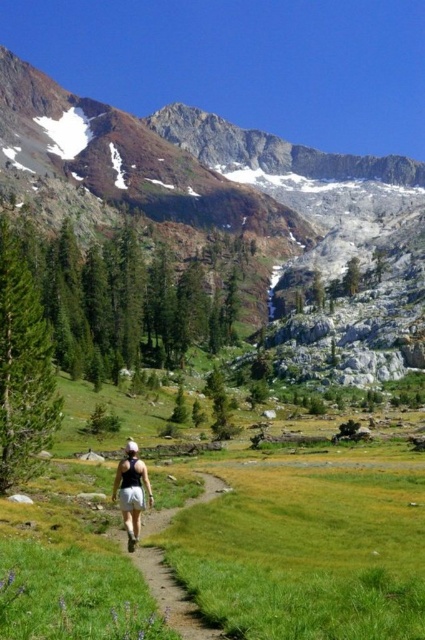
You are planning a hiking route and need to decide whether to take the path through the green grassy field at center or around the rocky gray mountain at upper center. Based on the scene description, which path would require less horizontal space to traverse?

The green grassy field at center has a lesser width compared to the rocky gray mountain at upper center, so traversing the green grassy field at center would require less horizontal space.

You are a hiker planning to take a photo of the rocky gray mountain at upper center and the white cotton shorts at center. Which object should you focus on first if you want both to be in sharp focus?

The rocky gray mountain at upper center is wider than the white cotton shorts at center, so focusing on the rocky gray mountain at upper center first would ensure both are in focus.

You are a hiker standing at the start of the dirt path in the meadow. You see the rocky gray mountain at upper center and the white cotton shorts at center. Which object is closer to you?

The rocky gray mountain at upper center is closer to you because the white cotton shorts at center is behind it.